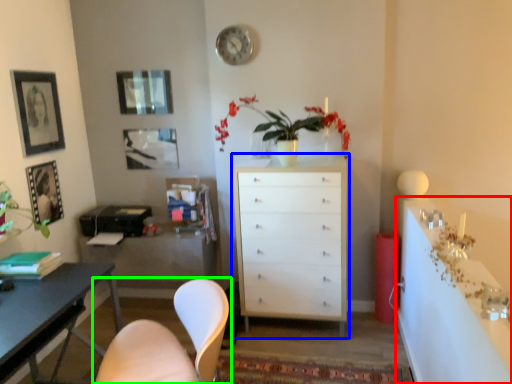
Question: Based on their relative distances, which object is nearer to computer desk (highlighted by a red box)? Choose from chest of drawers (highlighted by a blue box) and chair (highlighted by a green box).

Choices:
 (A) chest of drawers
 (B) chair

Answer: (A)